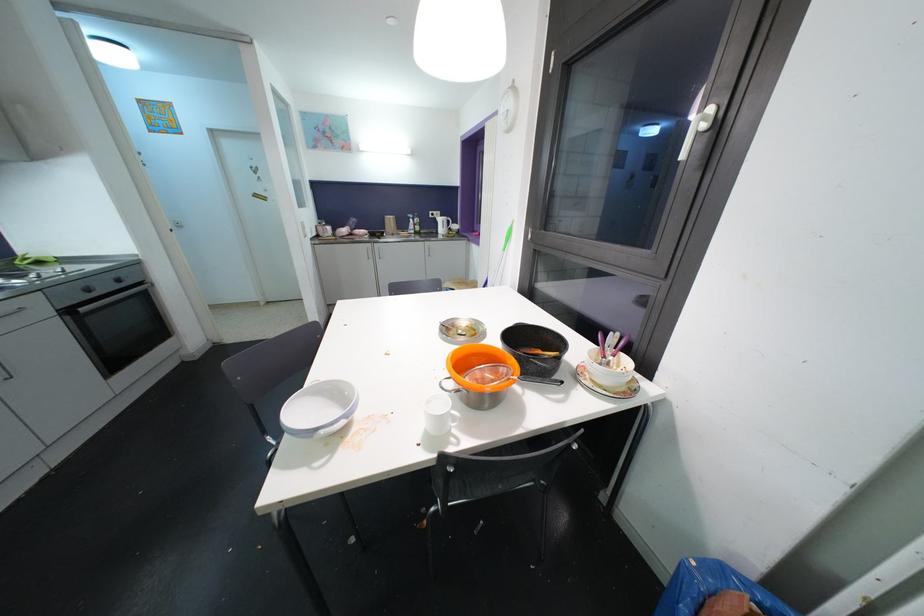
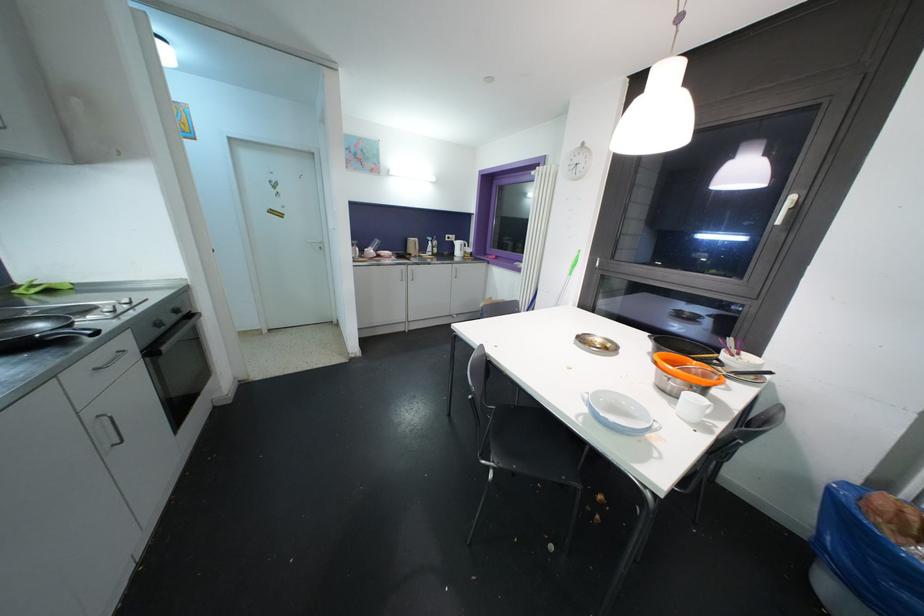
Question: What movement of the cameraman would produce the second image?

Choices:
 (A) Left
 (B) Right
 (C) Forward
 (D) Backward

Answer: (A)